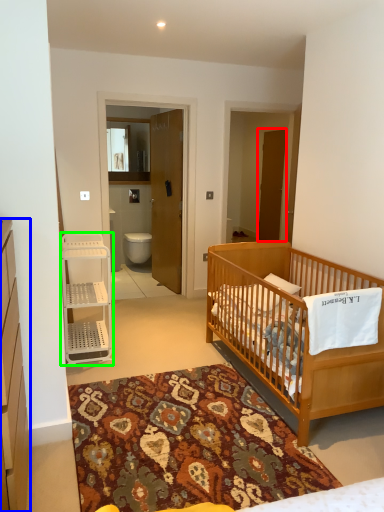
Question: Which object is the farthest from screen door (highlighted by a red box)? Choose among these: cabinetry (highlighted by a blue box) or shelf (highlighted by a green box).

Choices:
 (A) cabinetry
 (B) shelf

Answer: (A)